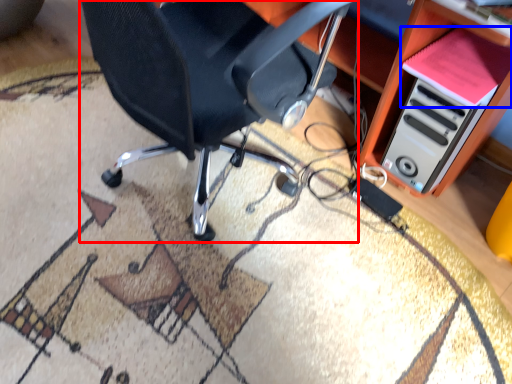
Question: Which point is closer to the camera, chair (highlighted by a red box) or book (highlighted by a blue box)?

Choices:
 (A) chair
 (B) book

Answer: (A)